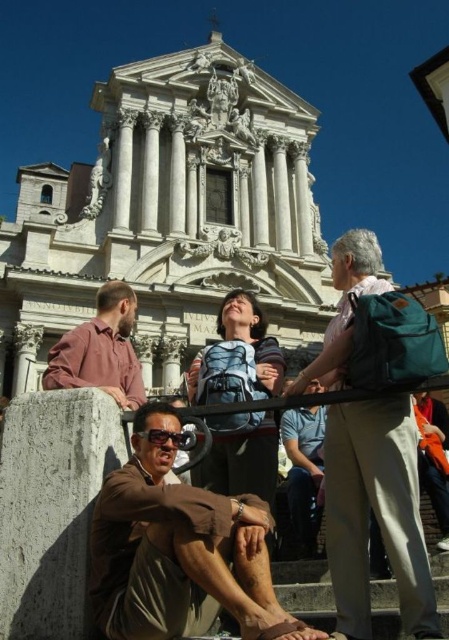
Consider the image. Is green fabric backpack at right above black plastic goggles at lower center?

Yes.

Find the location of `green fabric backpack at right`. green fabric backpack at right is located at coordinates (375, 513).

Consider the image. Which is above, green fabric backpack at right or blue backpack at center?

green fabric backpack at right is above.

Does green fabric backpack at right appear over blue backpack at center?

Indeed, green fabric backpack at right is positioned over blue backpack at center.

Identify the location of green fabric backpack at right. This screenshot has width=449, height=640. (375, 513).

Which is in front, point (142, 477) or point (294, 483)?

Point (142, 477) is more forward.

Who is higher up, brown cotton shirt at lower center or blue striped shirt at center?

Positioned higher is blue striped shirt at center.

The height and width of the screenshot is (640, 449). What do you see at coordinates (179, 552) in the screenshot? I see `brown cotton shirt at lower center` at bounding box center [179, 552].

Where is `brown cotton shirt at lower center`? The width and height of the screenshot is (449, 640). brown cotton shirt at lower center is located at coordinates (179, 552).